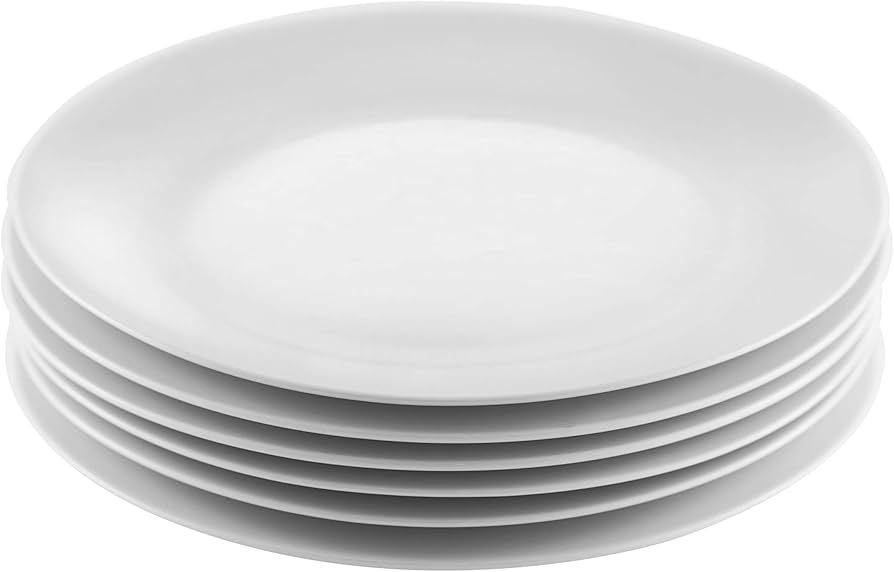
Locate an element on the screen. This screenshot has height=572, width=894. plates is located at coordinates (475, 384), (468, 430), (469, 456), (477, 480), (475, 511), (465, 551).